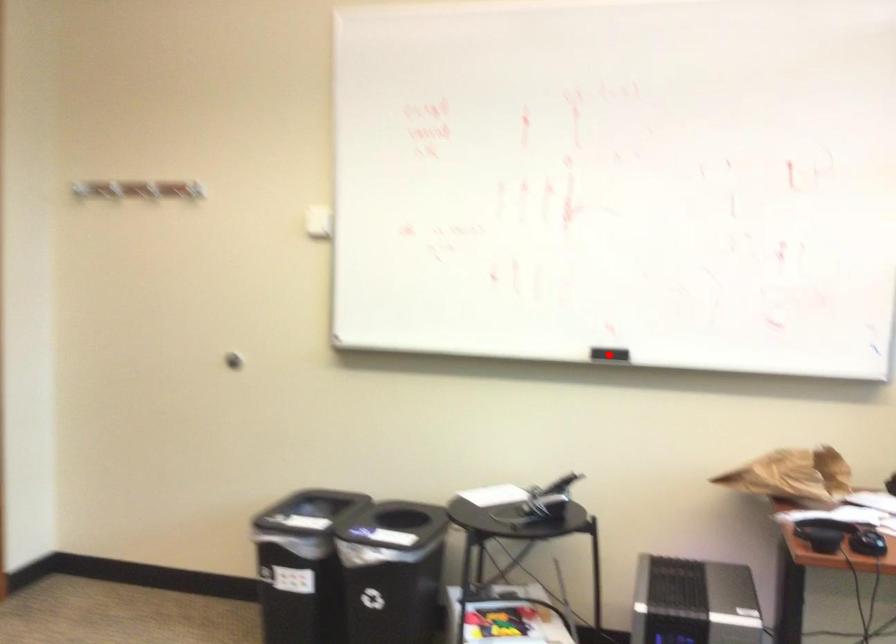
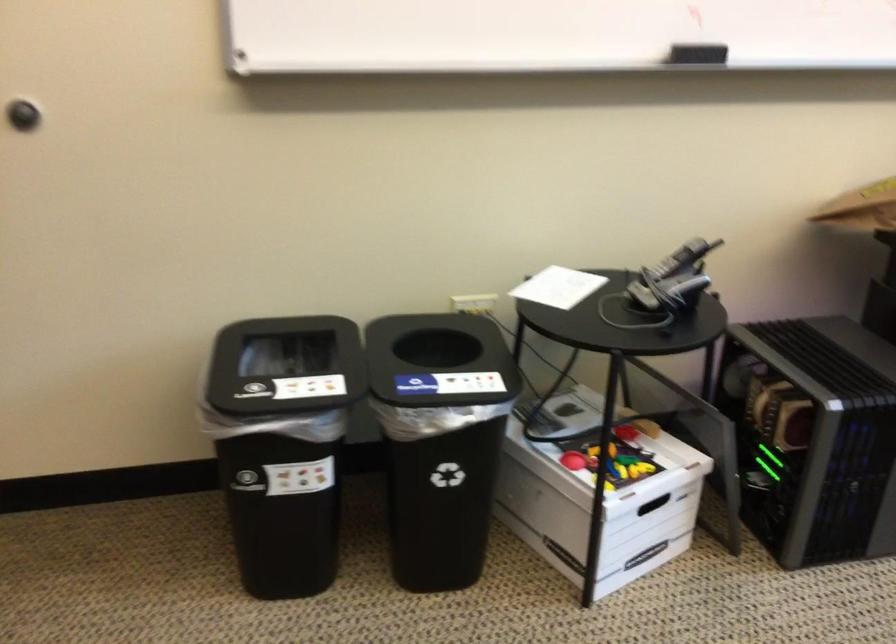
Question: I am providing you with two images of the same scene from different viewpoints. A red point is shown in image1. For the corresponding object point in image2, is it positioned nearer or farther from the camera?

Choices:
 (A) Nearer
 (B) Farther

Answer: (A)